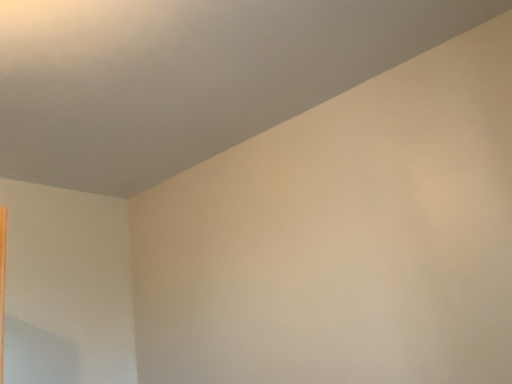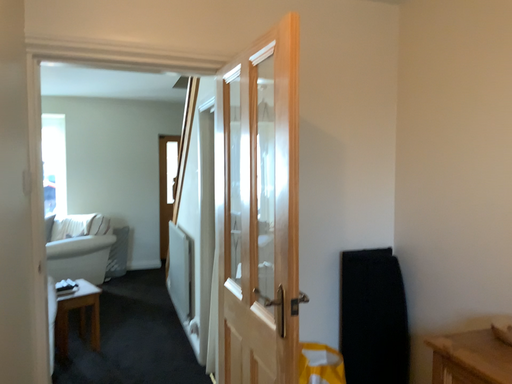
Question: How did the camera likely rotate when shooting the video?

Choices:
 (A) rotated downward
 (B) rotated upward

Answer: (A)